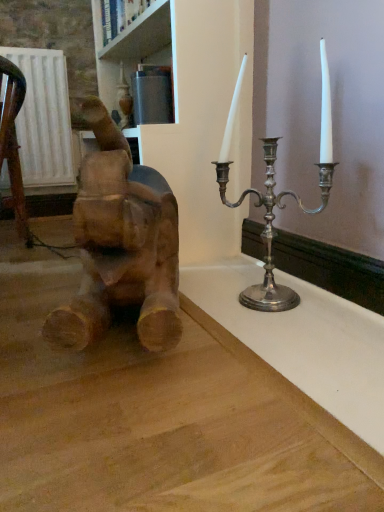
Identify the location of free space to the left of wooden elephant at left. The image size is (384, 512). (28, 310).